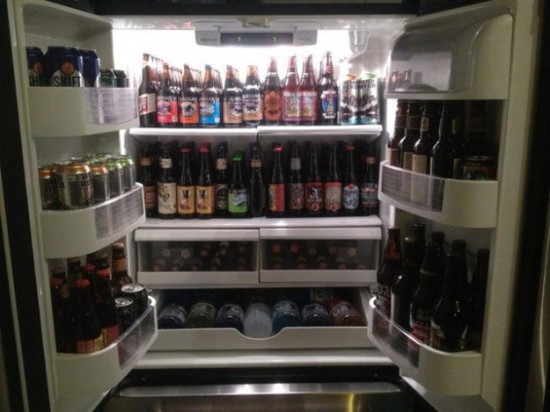
Find the location of `side door`. side door is located at coordinates (444, 69).